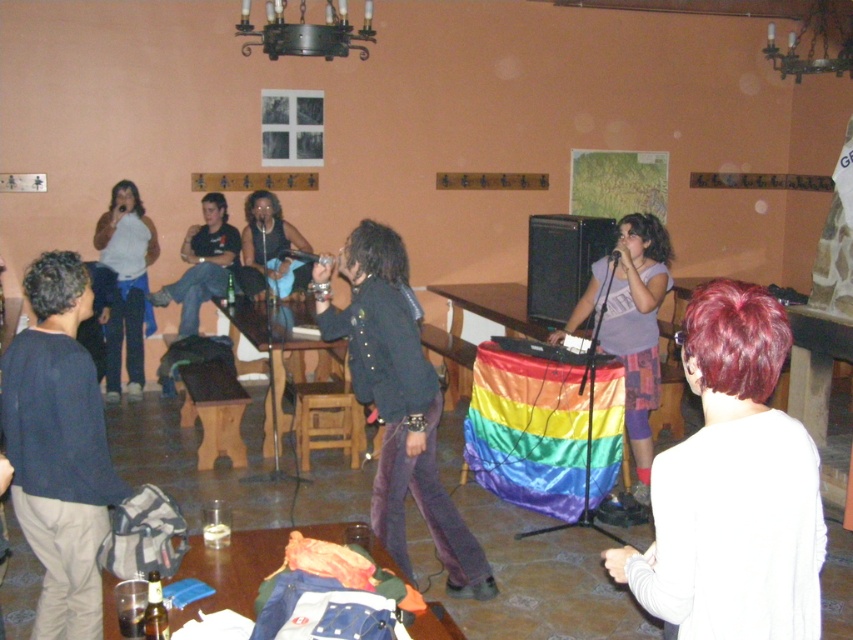
You are a photographer positioned at the camera. You want to capture a closeup shot of the white matte shirt at lower right. Considering the distance between you and the subject, is it feasible to get a clear closeup without moving closer?

The distance between the white matte shirt at lower right and the camera is 5.35 feet. A closeup shot can be achieved at this distance using a zoom lens, so it is feasible to capture a clear closeup without moving closer.

You are organizing a small concert in this room and need to place a 1.2 meter wide amplifier between the white matte shirt at lower right and the rainbow fabric dj booth at center. Is there enough space between them to fit the amplifier?

The white matte shirt at lower right has a lesser width compared to rainbow fabric dj booth at center. However, the question is about the space between them, not their widths. Since the description only provides information about their widths relative to each other, there isn not enough information to determine if the 1.2 meter wide amplifier can fit between them.

You are planning to hang a decorative banner above the rainbow fabric dj booth at center and the matte black jacket at left. Which object should the banner be placed closer to in order to ensure it hangs above both without touching either?

The banner should be placed closer to the matte black jacket at left because the rainbow fabric dj booth at center is shorter than the matte black jacket at left, so positioning it above the taller object ensures it can cover both without touching.